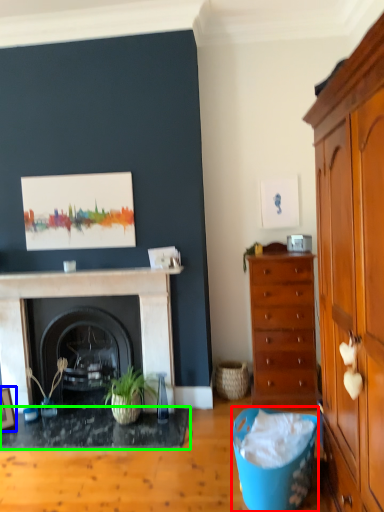
Question: Considering the real-world distances, which object is farthest from trash bin/can (highlighted by a red box)? picture frame (highlighted by a blue box) or desk (highlighted by a green box)?

Choices:
 (A) picture frame
 (B) desk

Answer: (A)